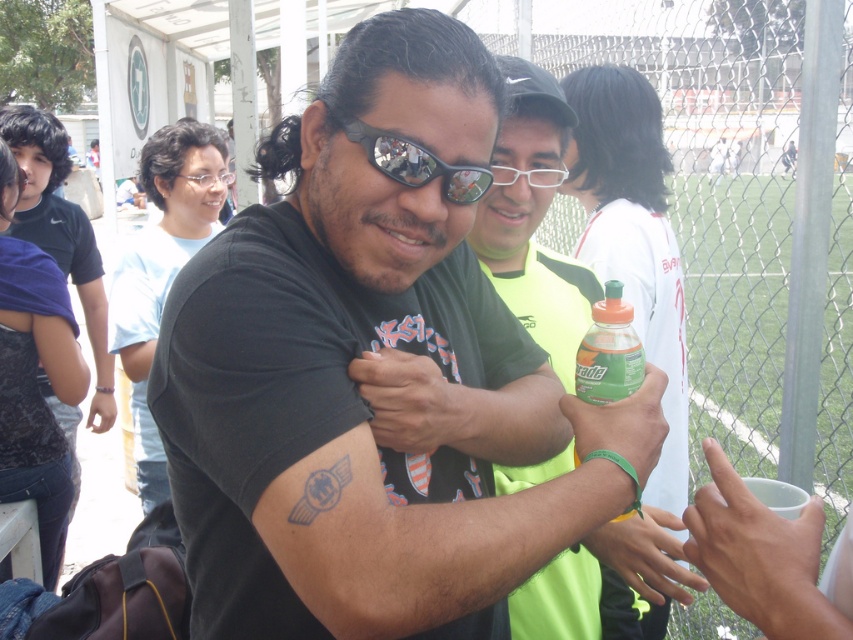
You are a photographer at a sports event and need to capture a clear shot of the green matte sports jersey at center and the matte black goggles at center. Since the jersey is taller than the goggles, how should you adjust your camera angle to ensure both are fully visible in the frame?

The green matte sports jersey at center is taller than the matte black goggles at center, so you should position your camera slightly lower to accommodate the height of the jersey while still capturing the goggles.

You are standing at point (395, 134) and want to move to point (567, 632). Is the path between these two points clear of any obstacles?

The path between point (395, 134) and point (567, 632) is clear because point (567, 632) is behind point (395, 134), so there are no obstacles blocking the way.